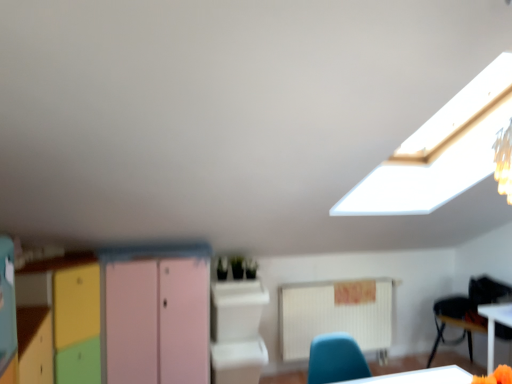
Question: Is white glossy table at lower right inside the boundaries of pastel wood cabinet at center, or outside?

Choices:
 (A) inside
 (B) outside

Answer: (B)

Question: Considering the positions of point (510, 307) and point (206, 357), is point (510, 307) closer or farther from the camera than point (206, 357)?

Choices:
 (A) closer
 (B) farther

Answer: (B)

Question: Which of these objects is positioned farthest from the pastel wood cabinet at center?

Choices:
 (A) pink matte/file cabinet at center
 (B) velvet black armchair at lower right
 (C) white glossy computer desk at center
 (D) white glossy table at lower right
 (E) white plastic chair at lower right

Answer: (B)

Question: Which object is the closest to the pastel wood cabinet at center?

Choices:
 (A) pink matte/file cabinet at center
 (B) white glossy computer desk at center
 (C) white plastic chair at lower right
 (D) velvet black armchair at lower right
 (E) white glossy table at lower right

Answer: (A)